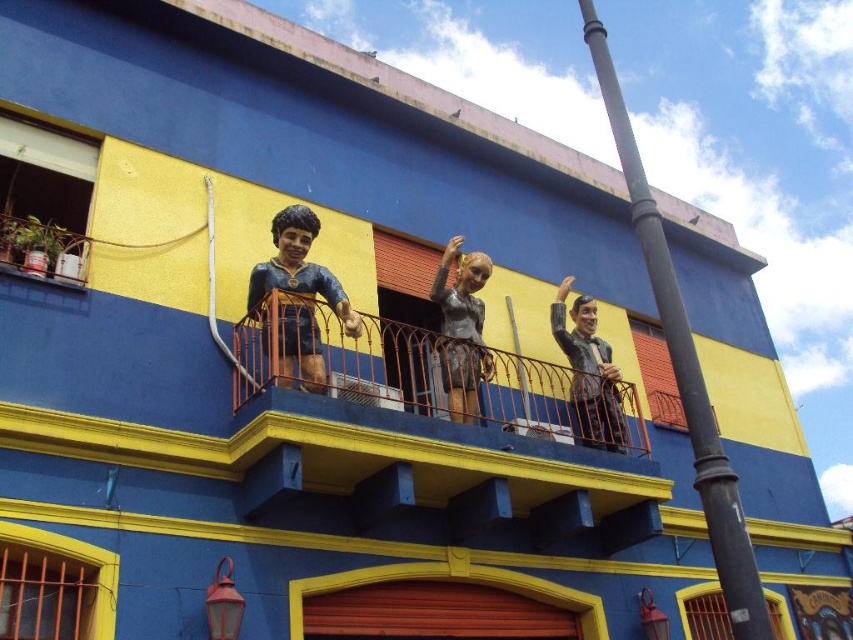
Question: Which of the following is the closest to the observer?

Choices:
 (A) (283, 300)
 (B) (618, 438)

Answer: (A)

Question: In this image, where is orange metal railing at upper center located relative to shiny gold statue at center?

Choices:
 (A) right
 (B) left

Answer: (A)

Question: Can you confirm if orange metal railing at upper center is positioned below shiny gold statue at center?

Choices:
 (A) yes
 (B) no

Answer: (A)

Question: Observing the image, what is the correct spatial positioning of orange metal railing at upper center in reference to shiny gold statue at center?

Choices:
 (A) below
 (B) above

Answer: (A)

Question: Which point appears farthest from the camera in this image?

Choices:
 (A) (514, 426)
 (B) (593, 352)
 (C) (306, 230)
 (D) (460, 378)

Answer: (B)

Question: Which is nearer to the orange metal railing at upper center?

Choices:
 (A) shiny silver statue at center
 (B) shiny gold statue at center
 (C) shiny black suit at upper right

Answer: (A)